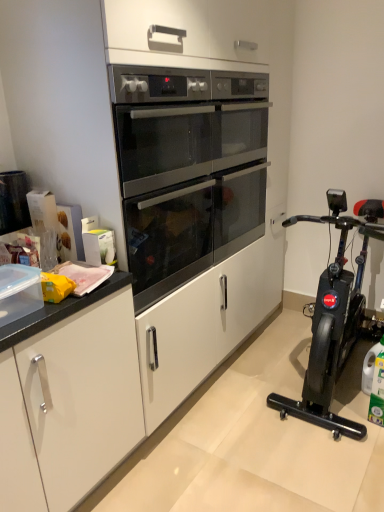
The width and height of the screenshot is (384, 512). In order to click on satin black oven at center in this screenshot , I will do `click(188, 170)`.

Measure the distance between satin black oven at center and camera.

They are 1.37 meters apart.

What do you see at coordinates (188, 170) in the screenshot?
I see `satin black oven at center` at bounding box center [188, 170].

Measure the distance between point (366, 242) and camera.

A distance of 8.87 feet exists between point (366, 242) and camera.

Locate an element on the screen. The width and height of the screenshot is (384, 512). black plastic exercise bike at right is located at coordinates (333, 319).

Describe the element at coordinates (333, 319) in the screenshot. I see `black plastic exercise bike at right` at that location.

Locate an element on the screen. This screenshot has height=512, width=384. satin black oven at center is located at coordinates (188, 170).

Considering the positions of objects black plastic exercise bike at right and satin black oven at center in the image provided, who is more to the left, black plastic exercise bike at right or satin black oven at center?

satin black oven at center is more to the left.

Is the depth of black plastic exercise bike at right greater than that of satin black oven at center?

No, it is in front of satin black oven at center.

Which is closer to the camera, (318, 321) or (123, 130)?

The point (123, 130) is in front.

Consider the image. From the image's perspective, relative to satin black oven at center, is black plastic exercise bike at right above or below?

Clearly, from the image's perspective, black plastic exercise bike at right is below satin black oven at center.

From a real-world perspective, does black plastic exercise bike at right sit lower than satin black oven at center?

Yes, from a real-world perspective, black plastic exercise bike at right is beneath satin black oven at center.

Which of these two, black plastic exercise bike at right or satin black oven at center, is wider?

Wider between the two is black plastic exercise bike at right.

Who is shorter, black plastic exercise bike at right or satin black oven at center?

satin black oven at center.

In the scene shown: Between black plastic exercise bike at right and satin black oven at center, which one has smaller size?

satin black oven at center.

Do you think black plastic exercise bike at right is within satin black oven at center, or outside of it?

black plastic exercise bike at right is not inside satin black oven at center, it's outside.

Is black plastic exercise bike at right not close to satin black oven at center?

They are positioned close to each other.

Is black plastic exercise bike at right turned away from satin black oven at center?

No, black plastic exercise bike at right's orientation is not away from satin black oven at center.

Can you tell me how much black plastic exercise bike at right and satin black oven at center differ in facing direction?

There is a 91.4-degree angle between the facing directions of black plastic exercise bike at right and satin black oven at center.

The height and width of the screenshot is (512, 384). Identify the location of oven behind the black plastic exercise bike at right. (188, 170).

Is satin black oven at center at the left side of black plastic exercise bike at right?

Correct, you'll find satin black oven at center to the left of black plastic exercise bike at right.

Considering their positions, is satin black oven at center located in front of or behind black plastic exercise bike at right?

satin black oven at center is behind black plastic exercise bike at right.

Is point (160, 177) closer or farther from the camera than point (312, 370)?

Point (160, 177).

Consider the image. From the image's perspective, which is above, satin black oven at center or black plastic exercise bike at right?

From the image's view, satin black oven at center is above.

From a real-world perspective, which object stands above the other?

satin black oven at center is physically above.

Is satin black oven at center wider than black plastic exercise bike at right?

In fact, satin black oven at center might be narrower than black plastic exercise bike at right.

Looking at this image, between satin black oven at center and black plastic exercise bike at right, which one has less height?

satin black oven at center is shorter.

Considering the sizes of objects satin black oven at center and black plastic exercise bike at right in the image provided, who is smaller, satin black oven at center or black plastic exercise bike at right?

Smaller between the two is satin black oven at center.

Is black plastic exercise bike at right completely or partially inside satin black oven at center?

Definitely not — black plastic exercise bike at right is not inside satin black oven at center.

Is satin black oven at center not close to black plastic exercise bike at right?

Result: No, satin black oven at center is not far from black plastic exercise bike at right.

Is satin black oven at center facing towards black plastic exercise bike at right?

Yes, satin black oven at center faces towards black plastic exercise bike at right.

How different are the orientations of satin black oven at center and black plastic exercise bike at right in degrees?

They differ by 91.4 degrees in their facing directions.

Image resolution: width=384 pixels, height=512 pixels. I want to click on home appliance in front of the satin black oven at center, so click(333, 319).

Find the location of a particular element. The image size is (384, 512). oven above the black plastic exercise bike at right (from a real-world perspective) is located at coordinates (188, 170).

The image size is (384, 512). In the image, there is a black plastic exercise bike at right. What are the coordinates of `oven above it (from the image's perspective)` in the screenshot? It's located at (188, 170).